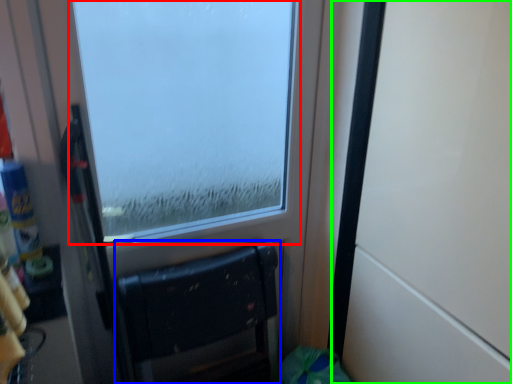
Question: Which object is positioned closest to window (highlighted by a red box)? Select from furniture (highlighted by a blue box) and door (highlighted by a green box).

Choices:
 (A) furniture
 (B) door

Answer: (A)